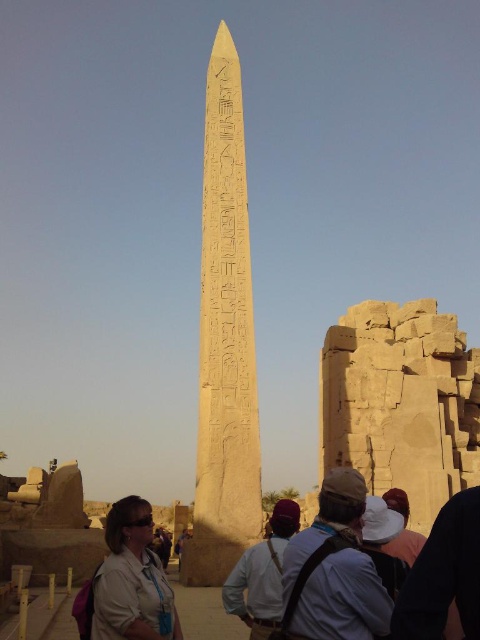
Which is above, yellow sandstone obelisk at center or white cotton hat at center?

Positioned higher is yellow sandstone obelisk at center.

Who is more distant from viewer, (225, 460) or (385, 552)?

The point (225, 460) is more distant.

Where is `yellow sandstone obelisk at center`? The image size is (480, 640). yellow sandstone obelisk at center is located at coordinates (225, 340).

Does yellow sandstone obelisk at center have a greater width compared to matte beige shirt at lower left?

Yes, yellow sandstone obelisk at center is wider than matte beige shirt at lower left.

This screenshot has width=480, height=640. In order to click on yellow sandstone obelisk at center in this screenshot , I will do `click(225, 340)`.

Is yellow sandstone obelisk at center bigger than white cotton shirt at center?

Correct, yellow sandstone obelisk at center is larger in size than white cotton shirt at center.

You are a GUI agent. You are given a task and a screenshot of the screen. Output one action in this format:
    pyautogui.click(x=<x>, y=<y>)
    Task: Click on the yellow sandstone obelisk at center
    The height and width of the screenshot is (640, 480).
    Given the screenshot: What is the action you would take?
    pyautogui.click(x=225, y=340)

Where is `yellow sandstone obelisk at center`? yellow sandstone obelisk at center is located at coordinates (225, 340).